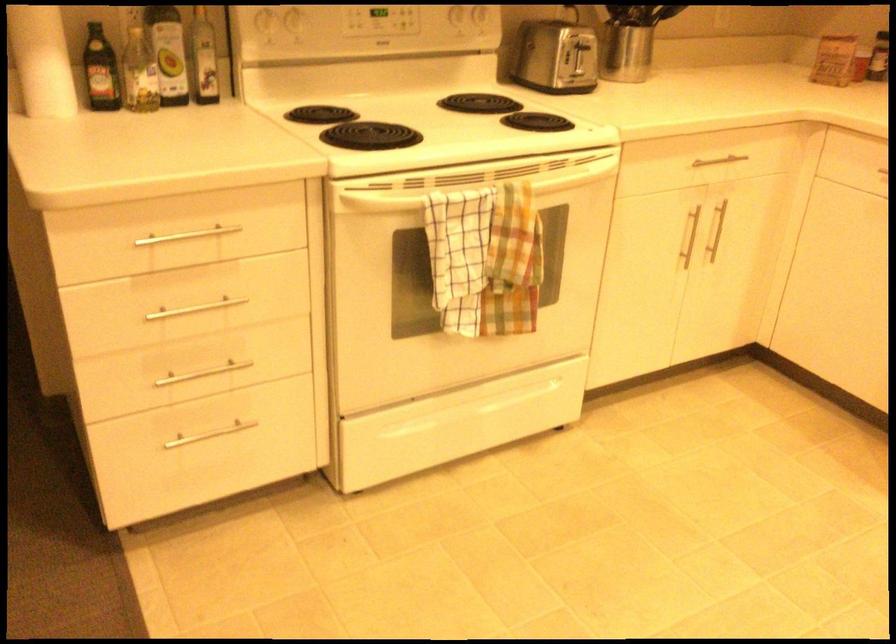
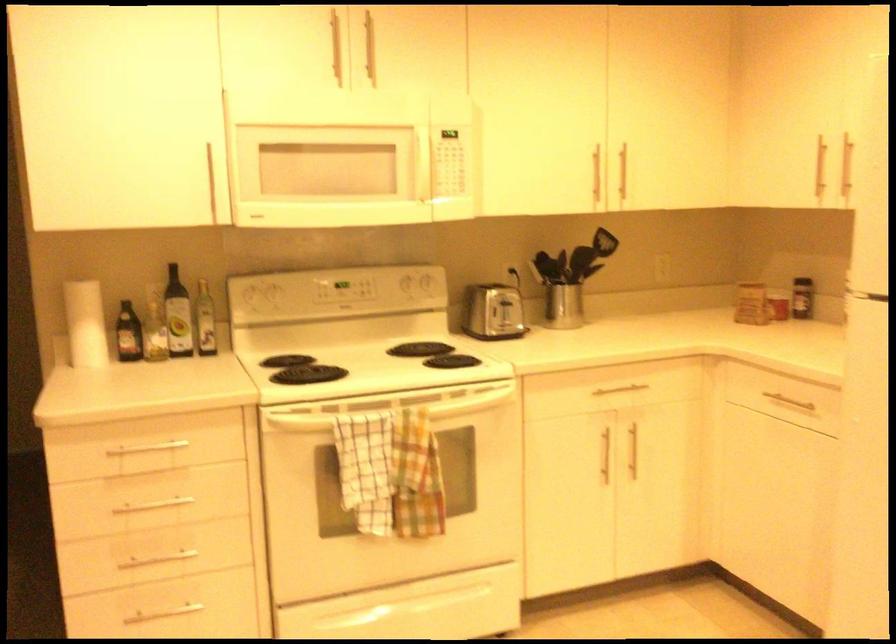
Find the pixel in the second image that matches point 492,203 in the first image.

(390, 424)